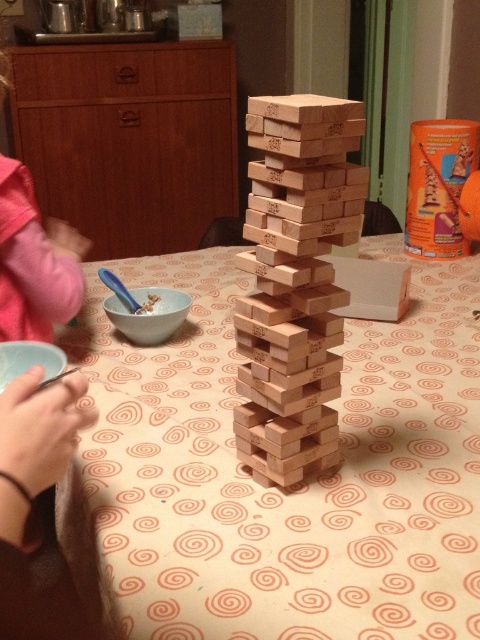
In the scene shown: Who is lower down, wooden table at center or pink fabric sleeve at left?

wooden table at center

Does point (409, 616) come farther from viewer compared to point (3, 54)?

No.

Is point (389, 627) positioned before point (23, 292)?

Yes, point (389, 627) is closer to viewer.

Locate an element on the screen. wooden table at center is located at coordinates (289, 486).

Which is above, natural wood tower at center or pink fabric sleeve at left?

pink fabric sleeve at left is above.

Measure the distance between point (302, 387) and camera.

They are 22.93 inches apart.

Between point (250, 253) and point (31, 205), which one is positioned in front?

Positioned in front is point (250, 253).

Find the location of a particular element. The width and height of the screenshot is (480, 640). natural wood tower at center is located at coordinates (295, 278).

The width and height of the screenshot is (480, 640). What do you see at coordinates (289, 486) in the screenshot?
I see `wooden table at center` at bounding box center [289, 486].

Is point (400, 628) farther from camera compared to point (264, 369)?

No, it is not.

You are a GUI agent. You are given a task and a screenshot of the screen. Output one action in this format:
    pyautogui.click(x=<x>, y=<y>)
    Task: Click on the wooden table at center
    
    Given the screenshot: What is the action you would take?
    pyautogui.click(x=289, y=486)